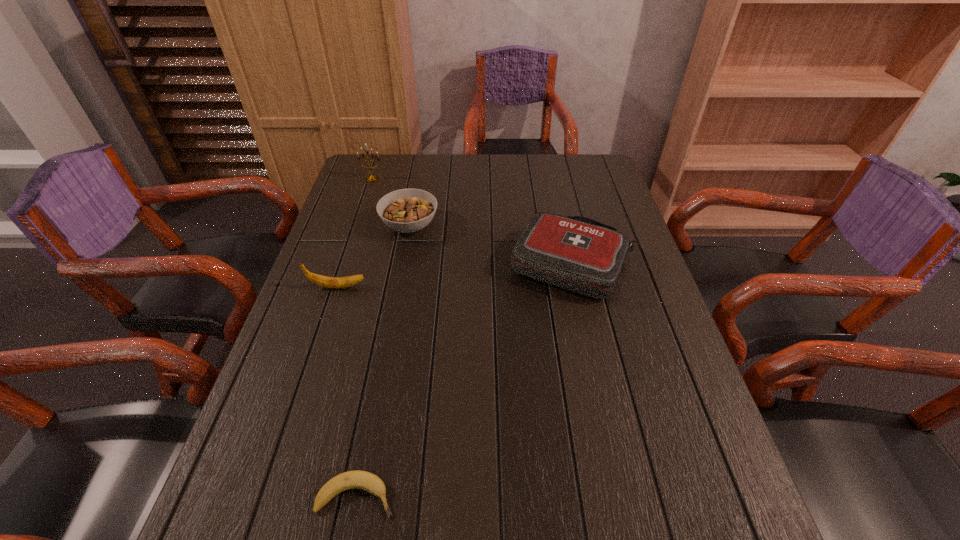
Find the location of a particular element. This screenshot has height=540, width=960. vacant space at the left edge is located at coordinates (336, 216).

Identify the location of free space at the right edge. The height and width of the screenshot is (540, 960). (708, 431).

In the image, there is a desktop. What are the coordinates of `vacant space at the far left corner` in the screenshot? It's located at click(x=360, y=172).

You are a GUI agent. You are given a task and a screenshot of the screen. Output one action in this format:
    pyautogui.click(x=<x>, y=<y>)
    Task: Click on the vacant area at the far right corner
    This screenshot has width=960, height=540.
    Given the screenshot: What is the action you would take?
    pyautogui.click(x=580, y=168)

What are the coordinates of `empty space between the taller banana and the farthest object` in the screenshot? It's located at (355, 233).

Where is `vacant space that's between the right banana and the taller banana`? vacant space that's between the right banana and the taller banana is located at coordinates (347, 392).

The width and height of the screenshot is (960, 540). In order to click on empty space between the tallest object and the farther banana in this screenshot , I will do `click(355, 233)`.

This screenshot has width=960, height=540. I want to click on free space between the first-aid kit and the nearest object, so click(x=464, y=380).

The height and width of the screenshot is (540, 960). I want to click on blank region between the candelabrum and the left banana, so click(x=355, y=233).

I want to click on free space between the left banana and the rightmost object, so [x=455, y=275].